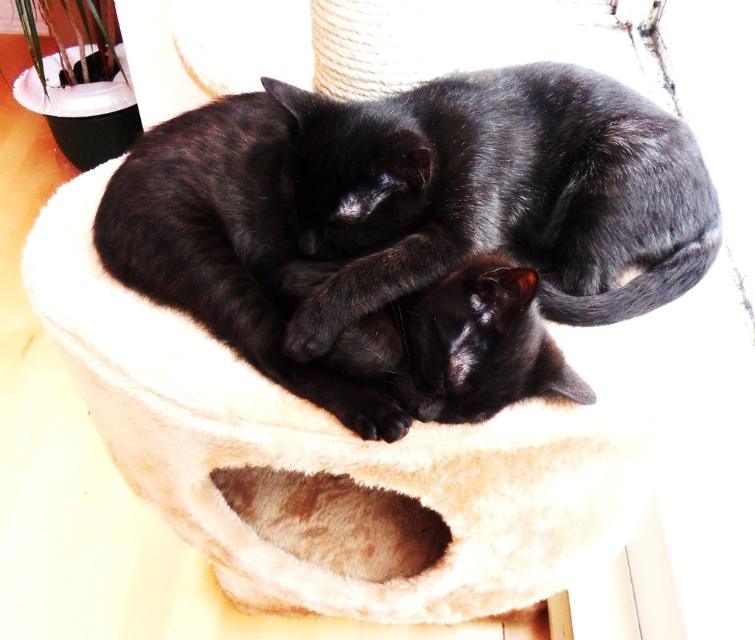
Image resolution: width=755 pixels, height=640 pixels. What do you see at coordinates (347, 445) in the screenshot?
I see `beige plush cat bed at center` at bounding box center [347, 445].

Does beige plush cat bed at center have a lesser width compared to black fur cat at center?

No.

Between point (230, 589) and point (341, 179), which one is positioned behind?

Positioned behind is point (230, 589).

Where is `beige plush cat bed at center`? beige plush cat bed at center is located at coordinates (347, 445).